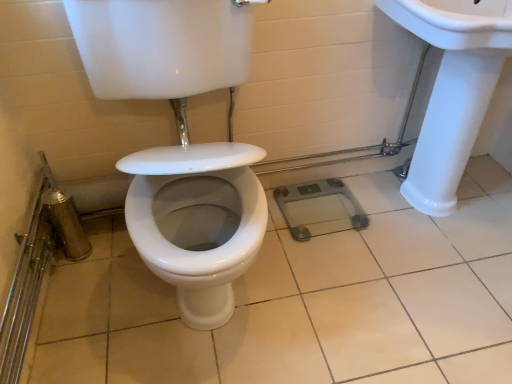
Question: Is white glossy sink at upper right to the left of white glossy tile at center from the viewer's perspective?

Choices:
 (A) no
 (B) yes

Answer: (A)

Question: From a real-world perspective, is white glossy sink at upper right under white glossy tile at center?

Choices:
 (A) yes
 (B) no

Answer: (B)

Question: Does white glossy sink at upper right have a lesser width compared to white glossy tile at center?

Choices:
 (A) no
 (B) yes

Answer: (B)

Question: Is white glossy sink at upper right directly adjacent to white glossy tile at center?

Choices:
 (A) no
 (B) yes

Answer: (A)

Question: Does white glossy sink at upper right have a larger size compared to white glossy tile at center?

Choices:
 (A) no
 (B) yes

Answer: (B)

Question: Can you confirm if white glossy sink at upper right is shorter than white glossy tile at center?

Choices:
 (A) yes
 (B) no

Answer: (B)

Question: Is white glossy tile at center positioned before white glossy sink at upper right?

Choices:
 (A) yes
 (B) no

Answer: (A)

Question: Considering the relative sizes of white glossy tile at center and white glossy sink at upper right in the image provided, is white glossy tile at center thinner than white glossy sink at upper right?

Choices:
 (A) yes
 (B) no

Answer: (B)

Question: Is white glossy tile at center wider than white glossy sink at upper right?

Choices:
 (A) yes
 (B) no

Answer: (A)

Question: Is white glossy tile at center facing away from white glossy sink at upper right?

Choices:
 (A) yes
 (B) no

Answer: (B)

Question: Can you confirm if white glossy tile at center is shorter than white glossy sink at upper right?

Choices:
 (A) no
 (B) yes

Answer: (B)

Question: Does white glossy tile at center lie behind white glossy sink at upper right?

Choices:
 (A) yes
 (B) no

Answer: (B)

Question: Considering the relative positions of white glossy tile at center and white glossy sink at upper right in the image provided, is white glossy tile at center to the left or to the right of white glossy sink at upper right?

Choices:
 (A) left
 (B) right

Answer: (A)